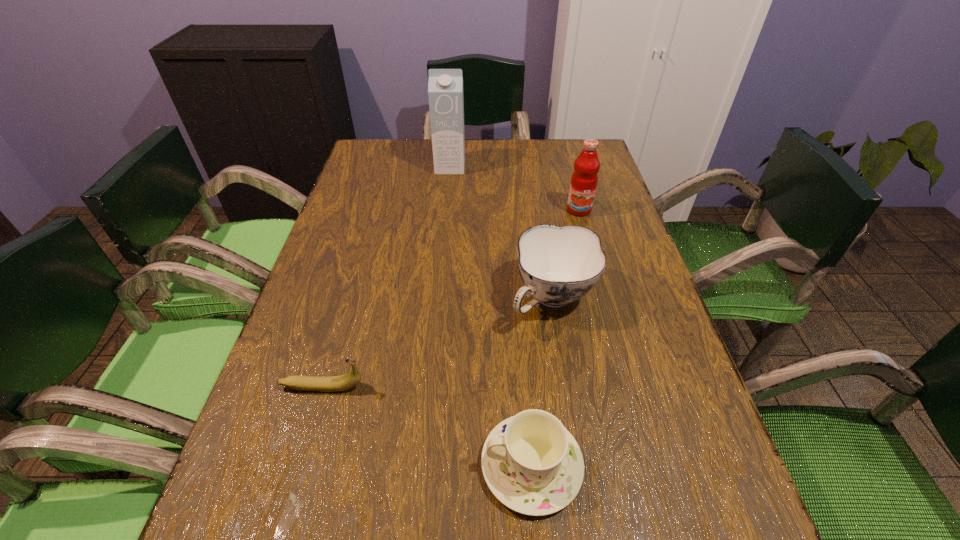
You are a GUI agent. You are given a task and a screenshot of the screen. Output one action in this format:
    pyautogui.click(x=<x>, y=<y>)
    Task: Click on the tallest object
    
    Given the screenshot: What is the action you would take?
    [x=445, y=86]

I want to click on carton, so click(x=445, y=86).

The width and height of the screenshot is (960, 540). Identify the location of the second tallest object. (584, 179).

Locate an element on the screen. Image resolution: width=960 pixels, height=540 pixels. fruit juice is located at coordinates (584, 179).

At what (x,y) coordinates should I click in order to perform the action: click on the taller chinaware. Please return your answer as a coordinate pair (x, y). The image size is (960, 540). Looking at the image, I should click on (x=558, y=265).

At what (x,y) coordinates should I click in order to perform the action: click on the third shortest object. Please return your answer as a coordinate pair (x, y). Looking at the image, I should click on (558, 265).

Where is `the leftmost object`? The image size is (960, 540). the leftmost object is located at coordinates (347, 381).

Find the location of a particular element. banana is located at coordinates (347, 381).

Image resolution: width=960 pixels, height=540 pixels. I want to click on the nearest object, so click(x=532, y=464).

Identify the location of the shorter chinaware. The height and width of the screenshot is (540, 960). (532, 464).